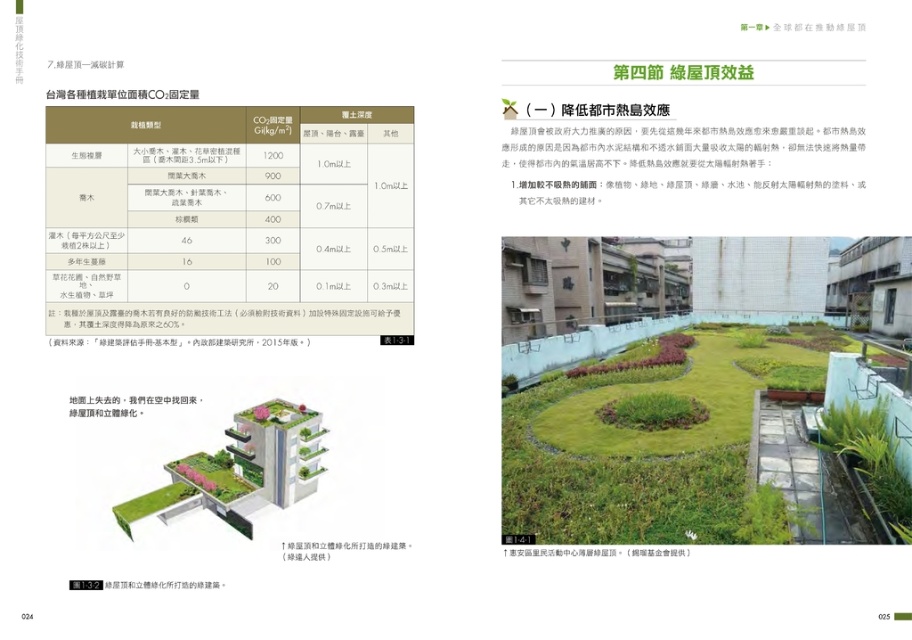
Question: Which point is farther to the camera?

Choices:
 (A) (718, 522)
 (B) (672, 403)

Answer: (B)

Question: Which object is farther from the camera taking this photo?

Choices:
 (A) green grass at center
 (B) green leafy plant at upper center
 (C) green grass at upper center

Answer: (A)

Question: Which point is farther to the camera?

Choices:
 (A) (615, 417)
 (B) (889, 516)
 (C) (548, 458)

Answer: (A)

Question: Does green grass at upper center come in front of green grass at center?

Choices:
 (A) no
 (B) yes

Answer: (B)

Question: Is green leafy plant at upper center positioned before green grass at center?

Choices:
 (A) yes
 (B) no

Answer: (A)

Question: Can you confirm if green grass at upper center is wider than green leafy plant at upper center?

Choices:
 (A) no
 (B) yes

Answer: (B)